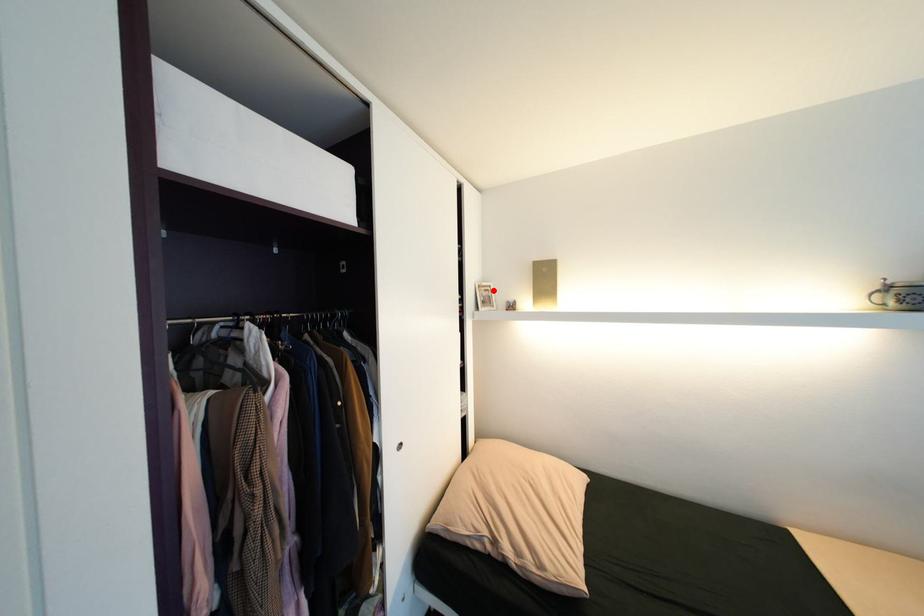
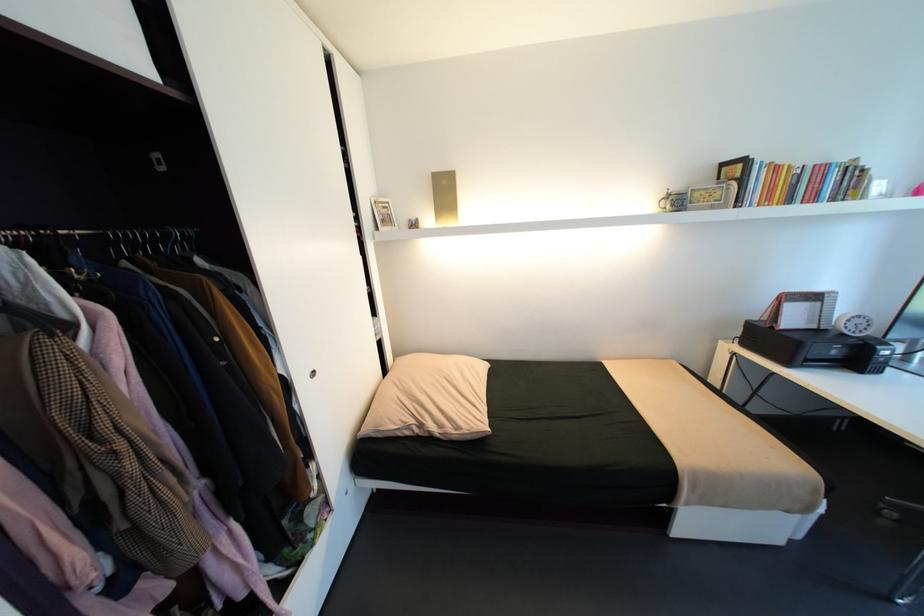
In the second image, find the point that corresponds to the highlighted location in the first image.

(392, 208)